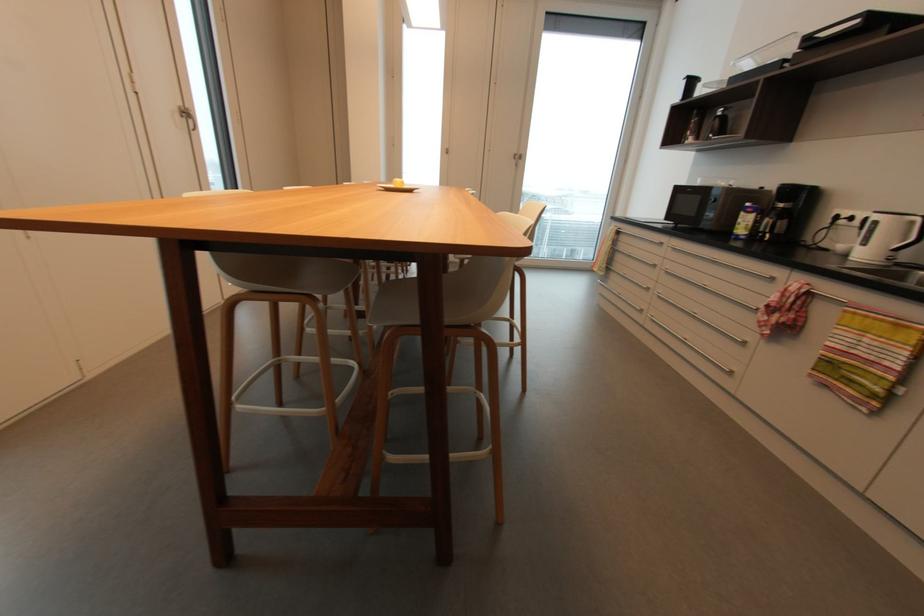
What are the coordinates of `window handle` in the screenshot? It's located at (188, 116).